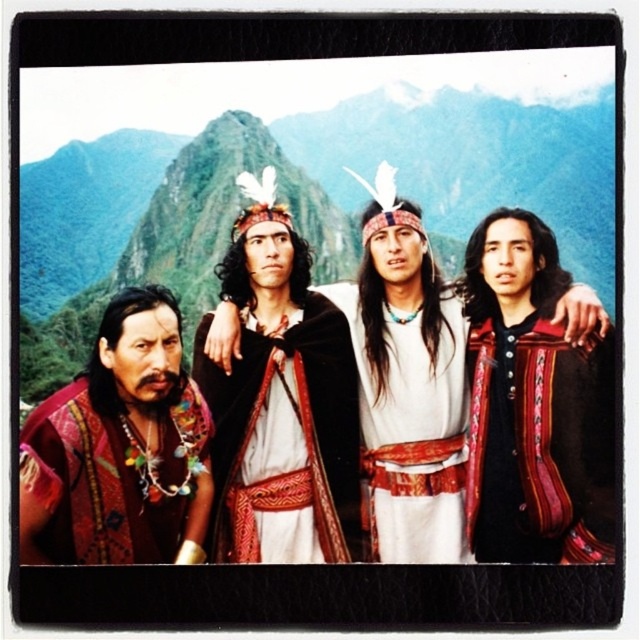
Looking at this image, you are a photographer planning to take a group photo of the textured wool shawl at right and the textured red fabric at left. Which one should you focus on first to ensure both are in sharp focus?

You should focus on the textured wool shawl at right first because it is closer to the viewer than the textured red fabric at left, so adjusting focus from near to far will help both be in sharp focus.